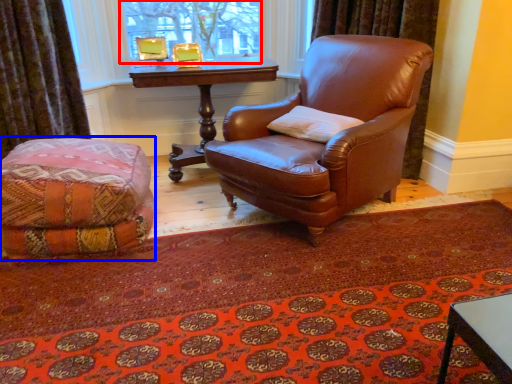
Question: Which of the following is the closest to the observer, bay window (highlighted by a red box) or couch (highlighted by a blue box)?

Choices:
 (A) bay window
 (B) couch

Answer: (B)